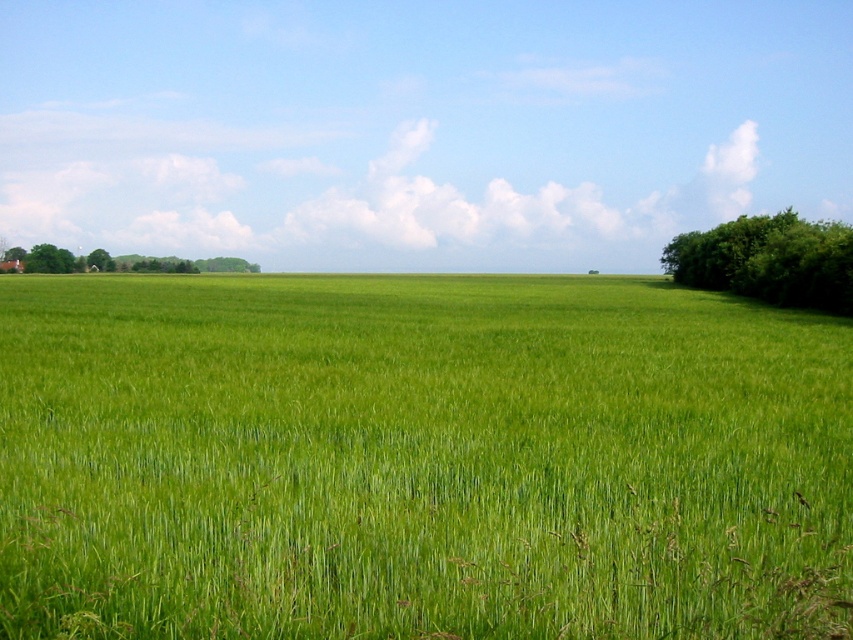
A farmer wants to plant a new row of crops between the green leafy trees at left and the cluster of darker trees on the right side. The recommended spacing for the crops is 500 feet. Can the farmer plant the crops in this area?

The distance between the green leafy trees at left and the cluster of darker trees on the right side is 607.04 feet, which is greater than the recommended 500 feet spacing. Therefore, the farmer can plant the crops in this area.

You are a hiker standing at the edge of the green grassy field at center and want to reach the green leafy trees at left. Which direction should you walk to get there?

The green leafy trees at left are positioned on the right side of the green grassy field at center, so you should walk to the right to reach them.

You are a landscape architect designing a new park. You have two areas to plant trees. The first area is where the green leafy tree at right is located, and the second area is where the green leafy trees at left are located. Which area should you choose if you want to plant trees that take up less space horizontally?

You should choose the area with the green leafy tree at right because its width is less than the green leafy trees at left, meaning it requires less horizontal space.